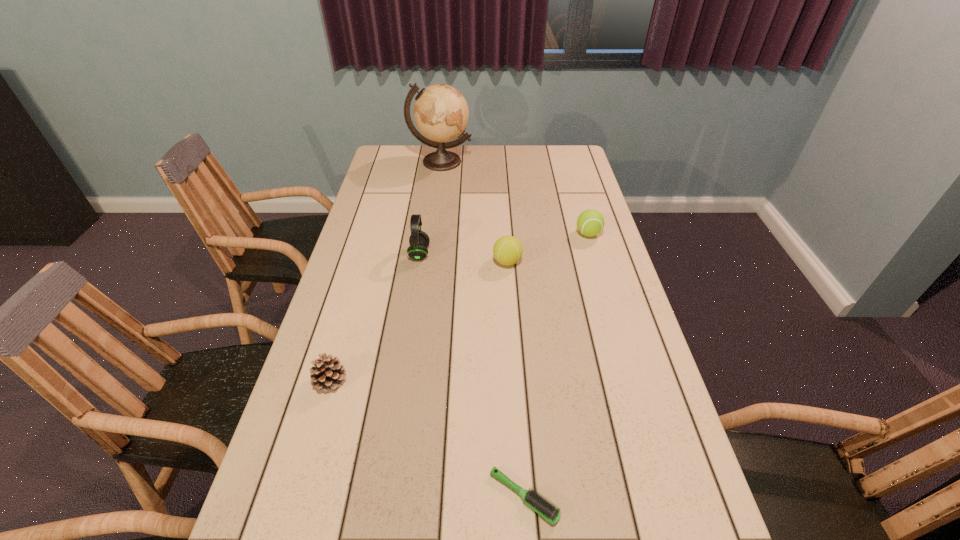
Identify the location of object at the far left corner. This screenshot has width=960, height=540. (441, 113).

Find the location of a particular element. The width and height of the screenshot is (960, 540). free space at the far edge is located at coordinates (467, 162).

Find the location of a particular element. This screenshot has width=960, height=540. vacant space at the left edge is located at coordinates (320, 327).

Image resolution: width=960 pixels, height=540 pixels. What are the coordinates of `vacant area at the right edge of the desktop` in the screenshot? It's located at (562, 194).

The height and width of the screenshot is (540, 960). I want to click on free region at the far left corner of the desktop, so [375, 171].

Image resolution: width=960 pixels, height=540 pixels. I want to click on free space at the far right corner, so click(x=577, y=160).

At what (x,y) coordinates should I click in order to perform the action: click on free space between the farther tennis ball and the nearest object. Please return your answer as a coordinate pair (x, y). The height and width of the screenshot is (540, 960). Looking at the image, I should click on (556, 365).

Identify the location of free point between the farther tennis ball and the nearest object. The height and width of the screenshot is (540, 960). pos(556,365).

You are a GUI agent. You are given a task and a screenshot of the screen. Output one action in this format:
    pyautogui.click(x=<x>, y=<y>)
    Task: Click on the free space between the left tennis ball and the leftmost object
    Image resolution: width=960 pixels, height=540 pixels.
    Given the screenshot: What is the action you would take?
    pyautogui.click(x=419, y=321)

Where is `free point between the nearest object and the headset`? The image size is (960, 540). free point between the nearest object and the headset is located at coordinates (471, 375).